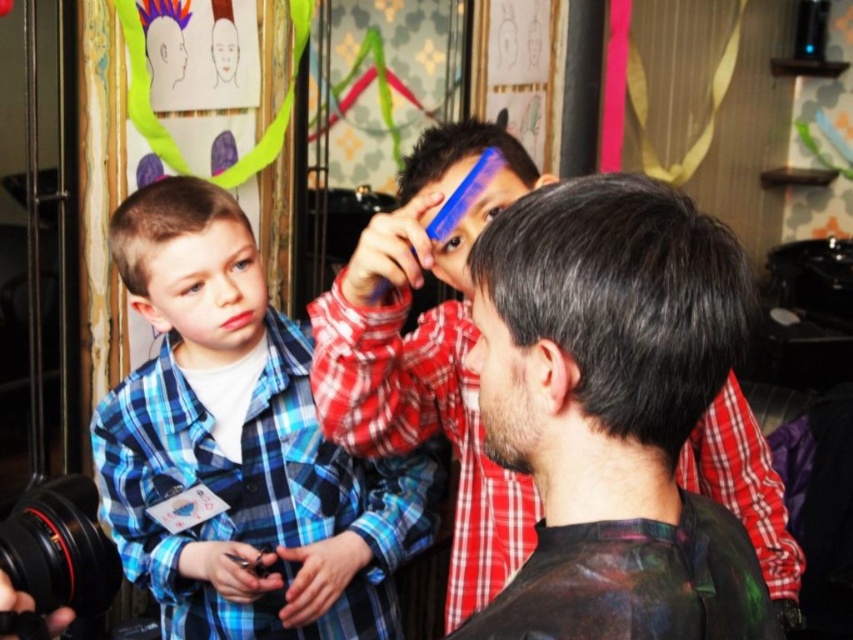
Which is in front, point (701, 429) or point (476, 140)?

Point (476, 140)

Is point (372, 372) farther from camera compared to point (469, 156)?

No, (372, 372) is in front of (469, 156).

Which is in front, point (434, 394) or point (531, 160)?

Point (531, 160) is more forward.

Where is `shiny black hair at center`? Image resolution: width=853 pixels, height=640 pixels. shiny black hair at center is located at coordinates (427, 355).

Between dark matte hair at center and blue plastic comb at upper center, which one is positioned lower?

dark matte hair at center

Is dark matte hair at center to the left of blue plastic comb at upper center from the viewer's perspective?

Incorrect, dark matte hair at center is not on the left side of blue plastic comb at upper center.

Locate an element on the screen. The width and height of the screenshot is (853, 640). dark matte hair at center is located at coordinates (622, 296).

Which is behind, point (612, 317) or point (166, 193)?

Positioned behind is point (166, 193).

Locate an element on the screen. The image size is (853, 640). dark matte hair at center is located at coordinates (622, 296).